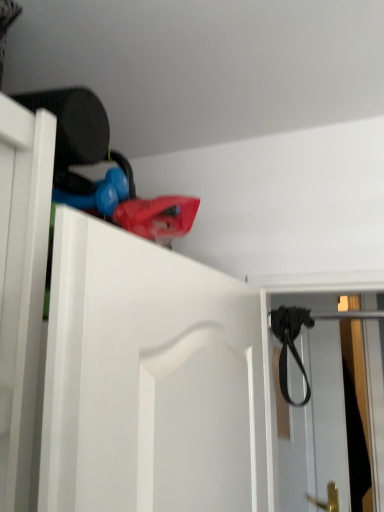
What do you see at coordinates (314, 422) in the screenshot? The height and width of the screenshot is (512, 384). I see `black rubber strap at upper right` at bounding box center [314, 422].

Locate an element on the screen. The image size is (384, 512). black rubber strap at upper right is located at coordinates (314, 422).

This screenshot has height=512, width=384. Describe the element at coordinates (286, 369) in the screenshot. I see `black leather strap at upper right` at that location.

Locate an element on the screen. black leather strap at upper right is located at coordinates (286, 369).

Where is `black rubber strap at upper right`? The image size is (384, 512). black rubber strap at upper right is located at coordinates (314, 422).

Which is more to the right, black rubber strap at upper right or black leather strap at upper right?

Positioned to the right is black rubber strap at upper right.

Between black rubber strap at upper right and black leather strap at upper right, which one is positioned behind?

Positioned behind is black rubber strap at upper right.

Does point (299, 475) come behind point (280, 386)?

Yes, point (299, 475) is behind point (280, 386).

From the image's perspective, would you say black rubber strap at upper right is positioned over black leather strap at upper right?

No, from the image's perspective, black rubber strap at upper right is not over black leather strap at upper right.

From a real-world perspective, relative to black leather strap at upper right, is black rubber strap at upper right vertically above or below?

black rubber strap at upper right is below black leather strap at upper right.

In terms of width, does black rubber strap at upper right look wider or thinner when compared to black leather strap at upper right?

In the image, black rubber strap at upper right appears to be wider than black leather strap at upper right.

Considering the relative sizes of black rubber strap at upper right and black leather strap at upper right in the image provided, is black rubber strap at upper right shorter than black leather strap at upper right?

In fact, black rubber strap at upper right may be taller than black leather strap at upper right.

Considering the sizes of objects black rubber strap at upper right and black leather strap at upper right in the image provided, who is bigger, black rubber strap at upper right or black leather strap at upper right?

Bigger between the two is black rubber strap at upper right.

Is black rubber strap at upper right surrounding black leather strap at upper right?

No, black leather strap at upper right is located outside of black rubber strap at upper right.

Is there a large distance between black rubber strap at upper right and black leather strap at upper right?

That's not correct — black rubber strap at upper right is a little close to black leather strap at upper right.

Could you tell me if black rubber strap at upper right is turned towards black leather strap at upper right?

No, black rubber strap at upper right is not turned towards black leather strap at upper right.

You are a GUI agent. You are given a task and a screenshot of the screen. Output one action in this format:
    pyautogui.click(x=<x>, y=<y>)
    Task: Click on the screen door below the black leather strap at upper right (from the image's perspective)
    This screenshot has height=512, width=384.
    Given the screenshot: What is the action you would take?
    pyautogui.click(x=314, y=422)

Does black leather strap at upper right appear on the right side of black rubber strap at upper right?

Incorrect, black leather strap at upper right is not on the right side of black rubber strap at upper right.

Does black leather strap at upper right come behind black rubber strap at upper right?

No.

Between point (300, 368) and point (333, 300), which one is positioned behind?

The point (333, 300) is farther from the camera.

From the image's perspective, is black leather strap at upper right on top of black rubber strap at upper right?

Yes.

From a real-world perspective, is black leather strap at upper right above or below black rubber strap at upper right?

From a real-world perspective, black leather strap at upper right is physically above black rubber strap at upper right.

Considering the sizes of objects black leather strap at upper right and black rubber strap at upper right in the image provided, who is wider, black leather strap at upper right or black rubber strap at upper right?

Wider between the two is black rubber strap at upper right.

Considering the relative sizes of black leather strap at upper right and black rubber strap at upper right in the image provided, is black leather strap at upper right shorter than black rubber strap at upper right?

Correct, black leather strap at upper right is not as tall as black rubber strap at upper right.

Based on their sizes in the image, would you say black leather strap at upper right is bigger or smaller than black rubber strap at upper right?

black leather strap at upper right is smaller than black rubber strap at upper right.

Is black rubber strap at upper right completely or partially inside black leather strap at upper right?

No.

Is black leather strap at upper right directly adjacent to black rubber strap at upper right?

black leather strap at upper right and black rubber strap at upper right are clearly separated.

Is black leather strap at upper right aimed at black rubber strap at upper right?

No, black leather strap at upper right is not facing towards black rubber strap at upper right.

Looking at this image, how many degrees apart are the facing directions of black leather strap at upper right and black rubber strap at upper right?

32.6 degrees.

Image resolution: width=384 pixels, height=512 pixels. In order to click on screen door that is under the black leather strap at upper right (from a real-world perspective) in this screenshot , I will do `click(314, 422)`.

The height and width of the screenshot is (512, 384). Identify the location of strap above the black rubber strap at upper right (from the image's perspective). (286, 369).

I want to click on strap on the left of black rubber strap at upper right, so click(286, 369).